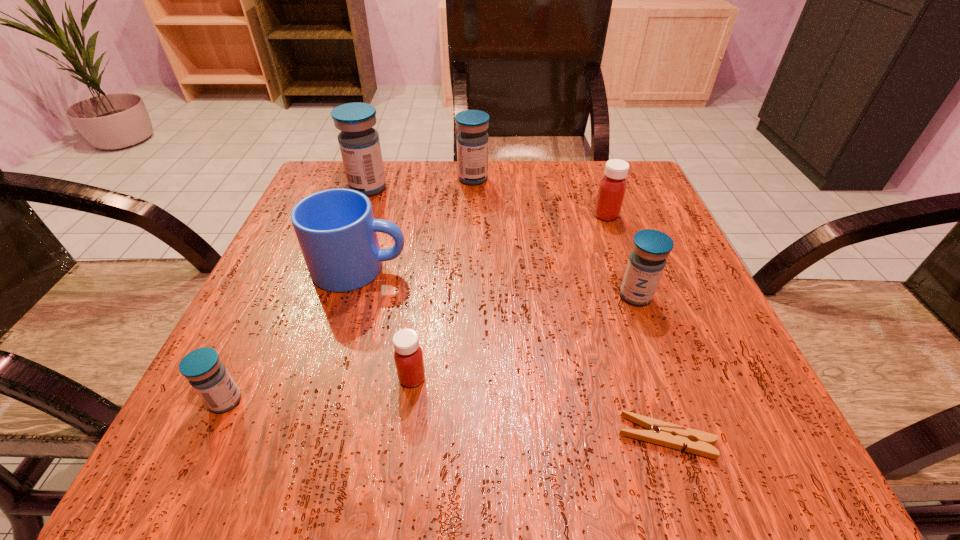
I want to click on vacant area that lies between the fifth object from left to right and the clothespin, so click(569, 308).

This screenshot has width=960, height=540. In order to click on free space between the mug and the bigger red medicine in this screenshot , I will do `click(483, 242)`.

Find the location of a particular element. empty space that is in between the fifth object from right to left and the clothespin is located at coordinates (540, 408).

Locate an element on the screen. This screenshot has width=960, height=540. vacant area that lies between the rightmost blue medicine and the tallest object is located at coordinates (502, 242).

Where is `vacant point located between the nearest blue medicine and the fifth medicine from right to left`? This screenshot has width=960, height=540. vacant point located between the nearest blue medicine and the fifth medicine from right to left is located at coordinates (297, 294).

Find the location of a particular element. The image size is (960, 540). free space that is in between the sixth nearest object and the smallest blue medicine is located at coordinates (416, 308).

This screenshot has height=540, width=960. What are the coordinates of `free space between the bigger red medicine and the biggest blue medicine` in the screenshot? It's located at (488, 202).

Find the location of `empty location between the third farthest object and the left red medicine`. empty location between the third farthest object and the left red medicine is located at coordinates (509, 296).

Identify the location of the fourth closest object to the farther red medicine. The width and height of the screenshot is (960, 540). (662, 433).

This screenshot has height=540, width=960. I want to click on object that stands as the fourth closest to the fifth object from left to right, so click(x=646, y=263).